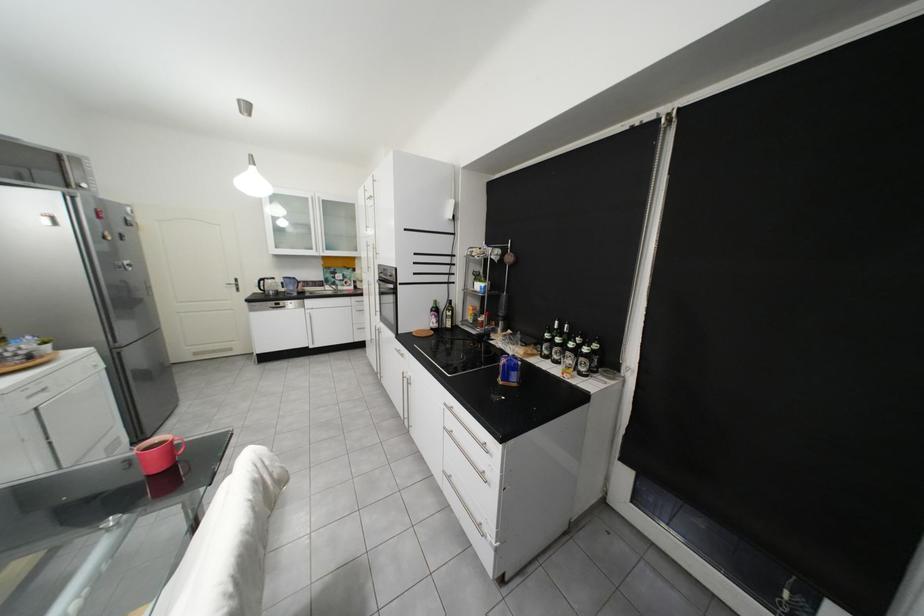
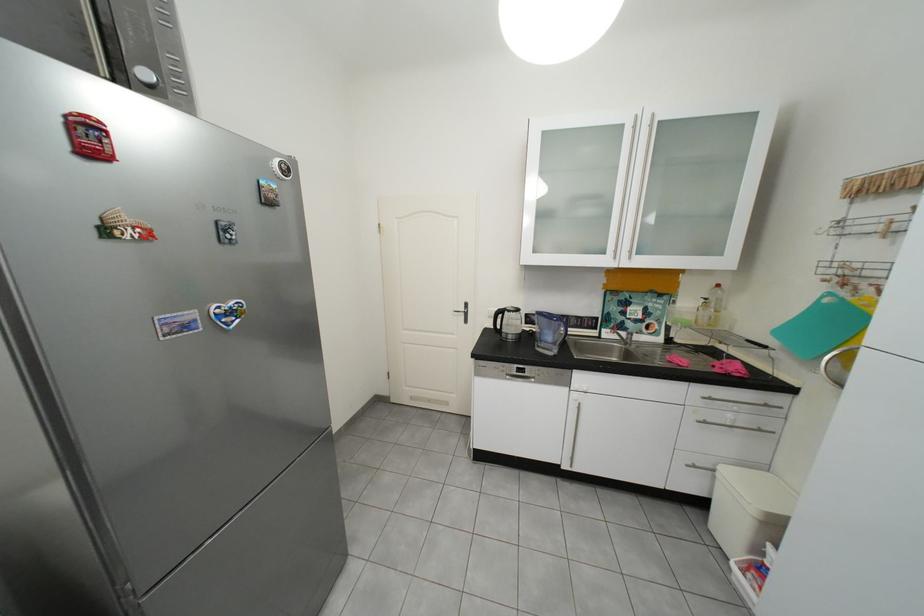
The point at [339,288] is marked in the first image. Where is the corresponding point in the second image?

(619, 334)